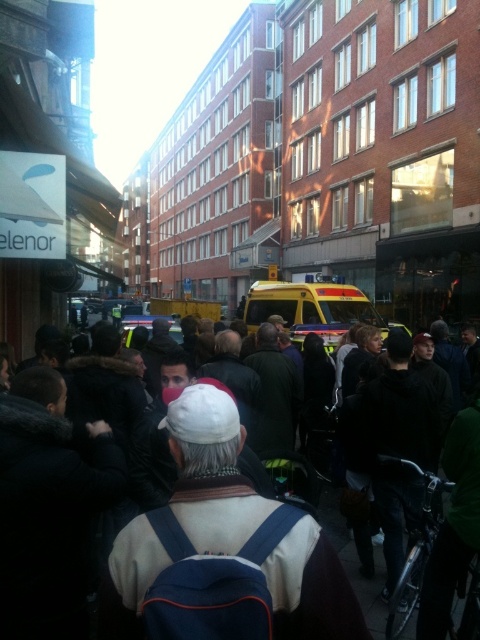
Question: In this image, where is white knitted hat at center located relative to yellow rubber taxi at center?

Choices:
 (A) below
 (B) above

Answer: (A)

Question: In this image, where is black fabric crowd at center located relative to yellow rubber taxi at center?

Choices:
 (A) left
 (B) right

Answer: (A)

Question: Can you confirm if white knitted hat at center is positioned above black fabric crowd at center?

Choices:
 (A) yes
 (B) no

Answer: (B)

Question: Which of the following is the closest to the observer?

Choices:
 (A) pyautogui.click(x=292, y=288)
 (B) pyautogui.click(x=149, y=552)

Answer: (B)

Question: Which of the following is the farthest from the observer?

Choices:
 (A) (331, 284)
 (B) (219, 458)

Answer: (A)

Question: Which point is farther from the camera taking this photo?

Choices:
 (A) (297, 552)
 (B) (335, 321)

Answer: (B)